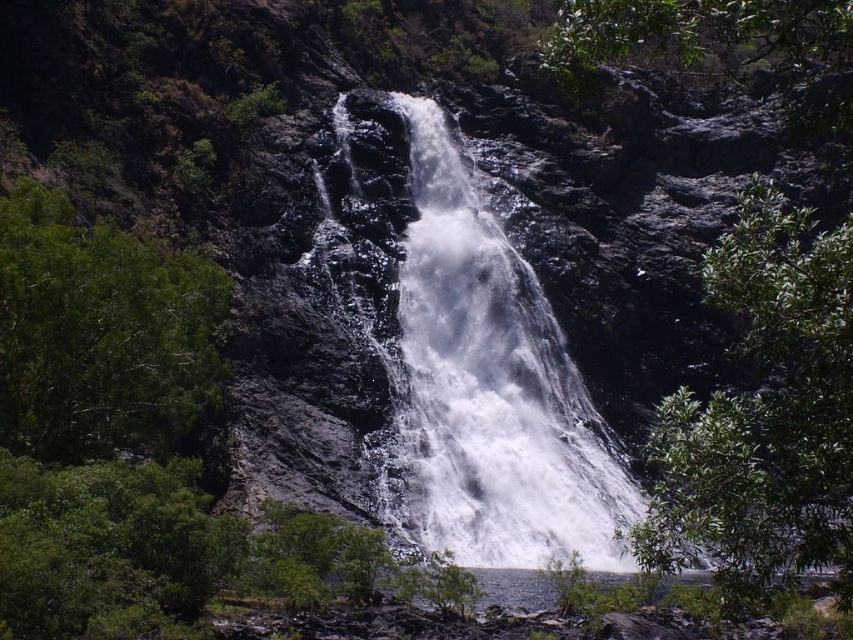
You are a hiker standing at the base of the waterfall. You notice the white frothy water at center and the green leafy tree at right. Which object is higher in elevation?

The white frothy water at center is above the green leafy tree at right, so it has a higher elevation.

You are standing at the edge of the waterfall and want to place a small sensor at each of the two points, point (x=433, y=458) and point (x=51, y=250). If you look directly at the waterfall, which point will appear closer to you?

Point (x=433, y=458) is further to the viewer than point (x=51, y=250), so the point that appears closer to you is point (x=51, y=250).